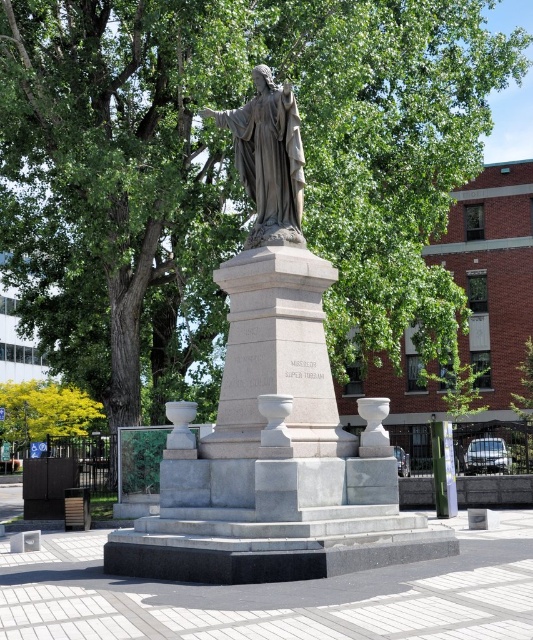
Can you confirm if matte gray statue at center is shorter than yellow-green leaves at lower left?

Correct, matte gray statue at center is not as tall as yellow-green leaves at lower left.

Does matte gray statue at center lie behind yellow-green leaves at lower left?

No, matte gray statue at center is in front of yellow-green leaves at lower left.

Where is `matte gray statue at center`? matte gray statue at center is located at coordinates 269,157.